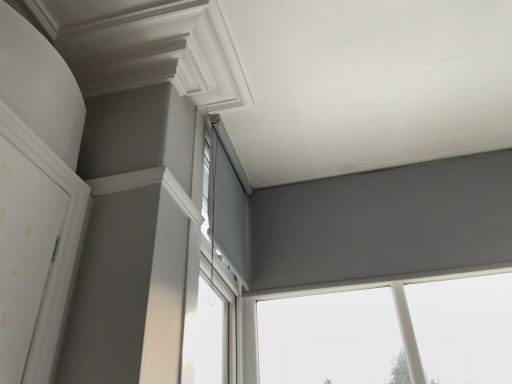
Question: From a real-world perspective, is white plastic window at upper center, acting as the first window starting from the left, positioned above or below matte gray roller blind at center, acting as the 2th window starting from the right?

Choices:
 (A) above
 (B) below

Answer: (B)

Question: Based on their positions, is white plastic window at upper center, acting as the first window starting from the left, located to the left or right of matte gray roller blind at center, the second window from the left?

Choices:
 (A) left
 (B) right

Answer: (A)

Question: Which object is positioned farthest from the matte gray roller blind at center, acting as the 2th window starting from the right?

Choices:
 (A) matte gray window at upper center, placed as the first window when sorted from right to left
 (B) white plastic window at upper center, acting as the first window starting from the left

Answer: (A)

Question: Which object is the closest to the matte gray roller blind at center, the second window from the left?

Choices:
 (A) white plastic window at upper center, acting as the first window starting from the left
 (B) matte gray window at upper center, placed as the first window when sorted from right to left

Answer: (A)